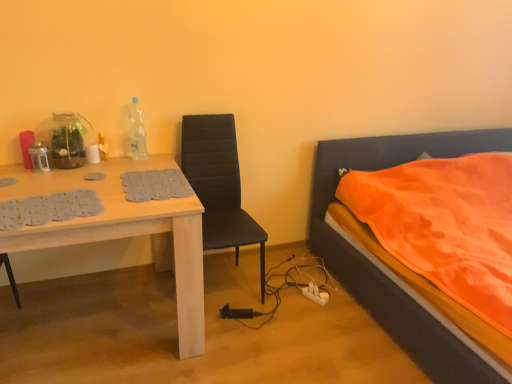
Locate an element on the screen. free space above light wood table at left (from a real-world perspective) is located at coordinates (95, 184).